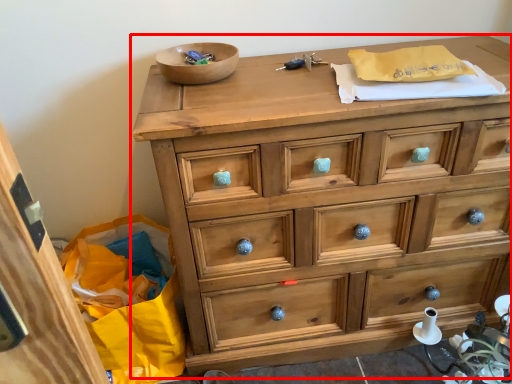
Question: From the image's perspective, what is the correct spatial relationship of chest of drawers (annotated by the red box) in relation to bowl?

Choices:
 (A) above
 (B) below

Answer: (B)